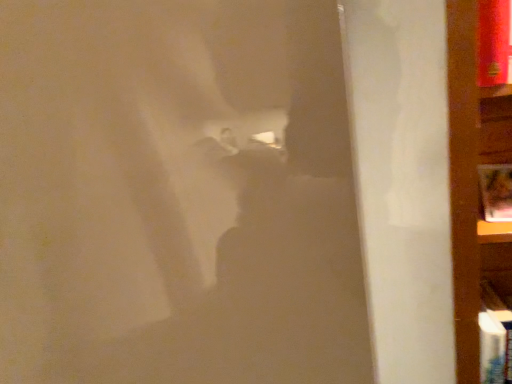
What do you see at coordinates (496, 192) in the screenshot? Image resolution: width=512 pixels, height=384 pixels. I see `hardcover book at right` at bounding box center [496, 192].

What is the approximate height of hardcover book at right?

The height of hardcover book at right is 9.25 centimeters.

Locate an element on the screen. The height and width of the screenshot is (384, 512). hardcover book at right is located at coordinates (x=496, y=192).

Find the location of `hardcover book at right`. hardcover book at right is located at coordinates (496, 192).